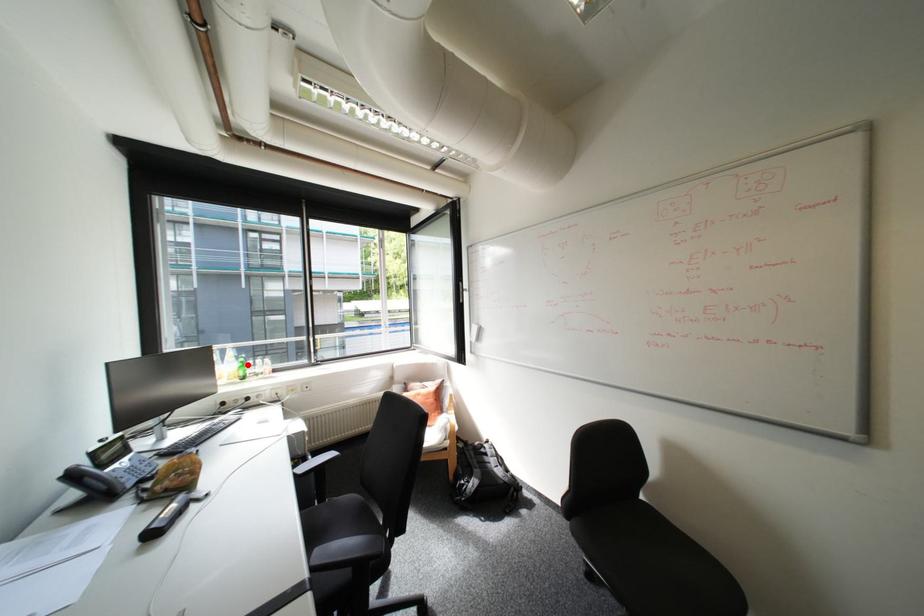
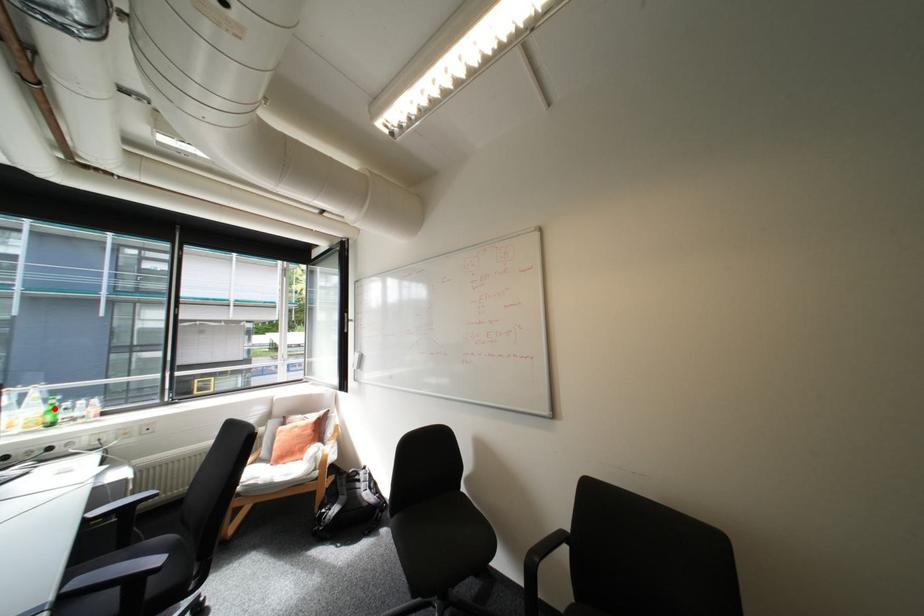
I am providing you with two images of the same scene from different viewpoints. A red point is marked on the first image and another point is marked on the second image. Do the highlighted points in image1 and image2 indicate the same real-world spot?

Yes